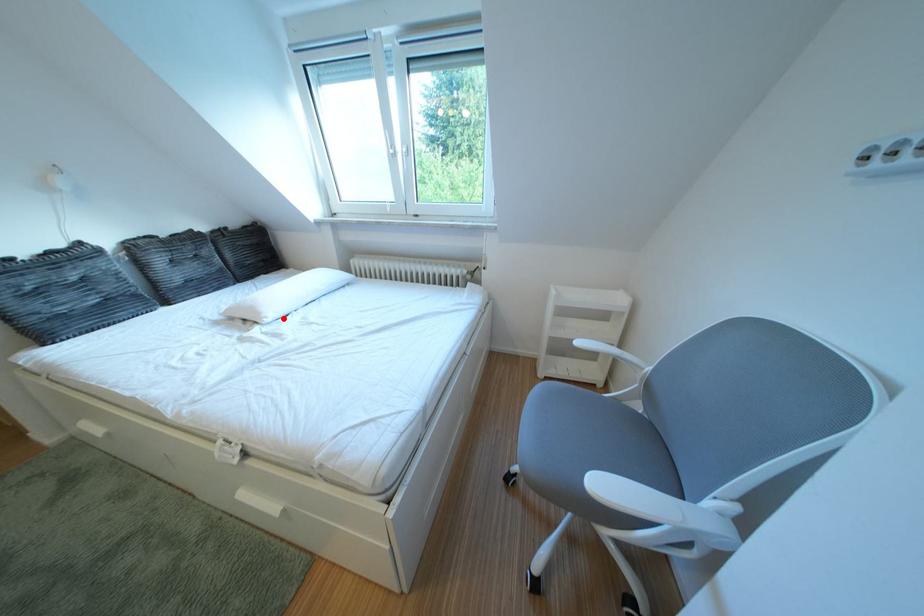
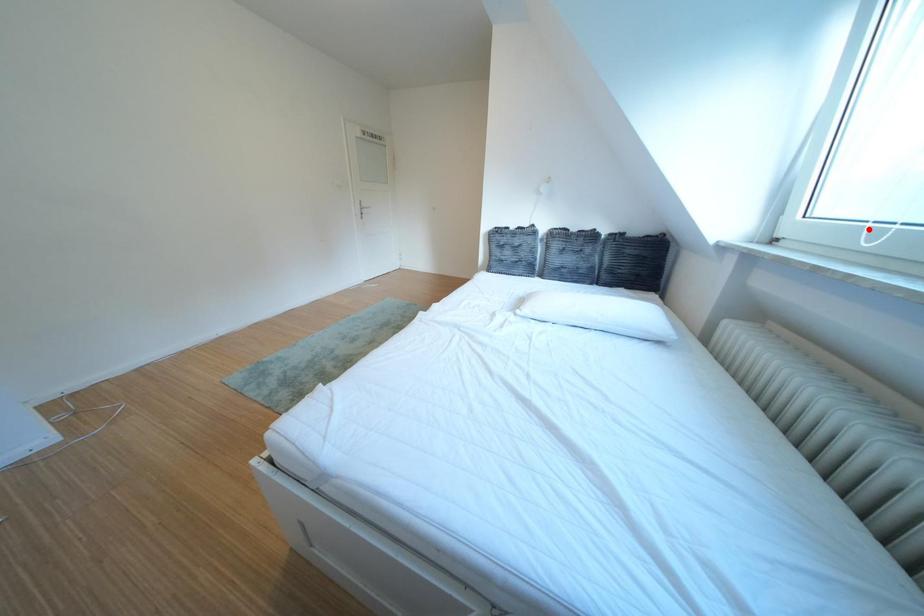
I am providing you with two images of the same scene from different viewpoints. A red point is marked on the first image and another point is marked on the second image. Is the red point in image1 aligned with the point shown in image2?

No